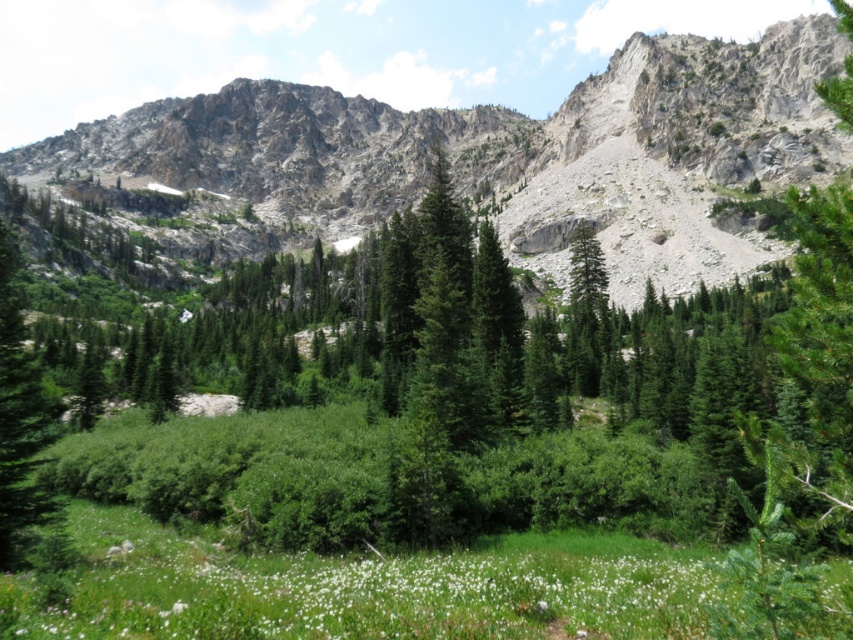
Question: Does rocky gray mountain at upper center have a smaller size compared to white fluffy flower at lower center?

Choices:
 (A) no
 (B) yes

Answer: (A)

Question: Which point is farther to the camera?

Choices:
 (A) white fluffy flower at lower center
 (B) rocky gray mountain at upper center

Answer: (B)

Question: Does rocky gray mountain at upper center come behind white fluffy flower at lower center?

Choices:
 (A) yes
 (B) no

Answer: (A)

Question: Which point is farther to the camera?

Choices:
 (A) (704, 38)
 (B) (289, 604)

Answer: (A)

Question: Is rocky gray mountain at upper center positioned before white fluffy flower at lower center?

Choices:
 (A) yes
 (B) no

Answer: (B)